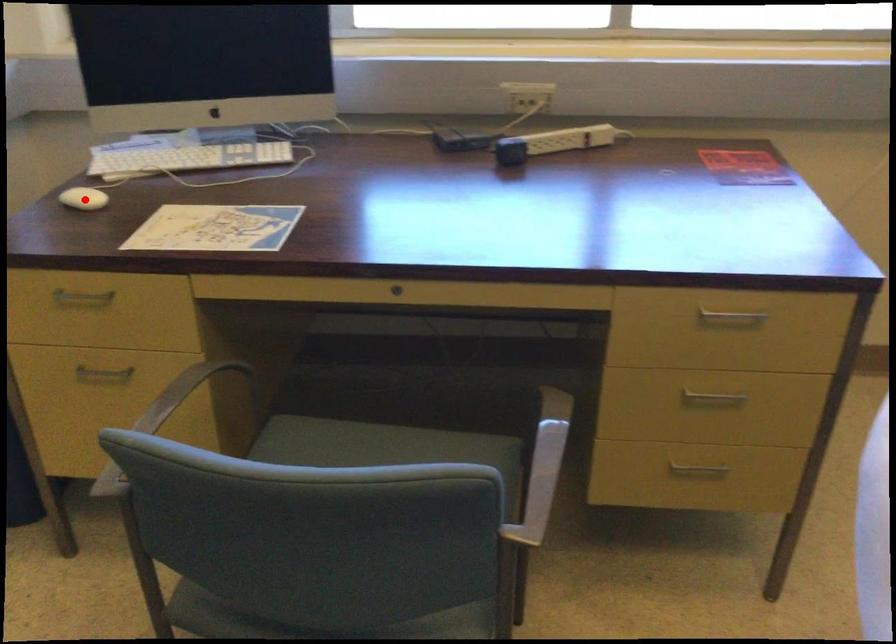
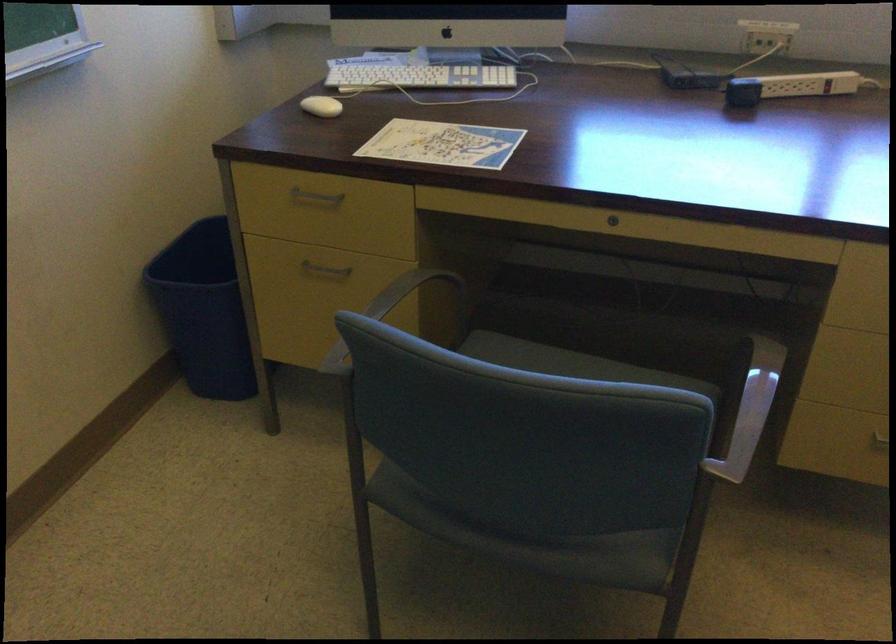
Question: I am providing you with two images of the same scene from different viewpoints. A red point is marked on the first image. At the location where the point appears in image 1, is it still visible in image 2?

Choices:
 (A) Yes
 (B) No

Answer: (A)